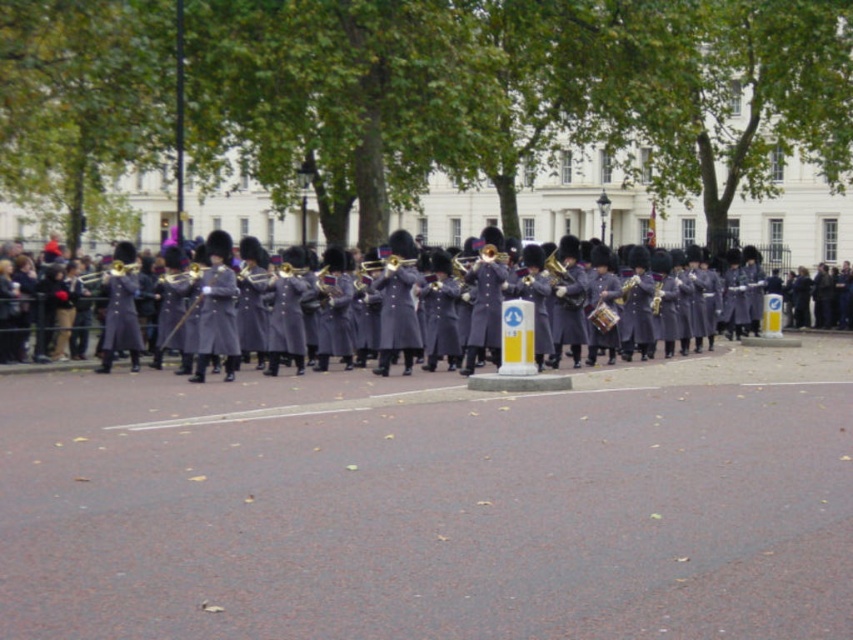
Between matte gray uniform at center and matte gold trumpet at center, which one is positioned higher?

Positioned higher is matte gold trumpet at center.

Is matte gray uniform at center to the right of matte gold trumpet at center from the viewer's perspective?

Yes, matte gray uniform at center is to the right of matte gold trumpet at center.

Identify the location of matte gray uniform at center. The height and width of the screenshot is (640, 853). (88, 317).